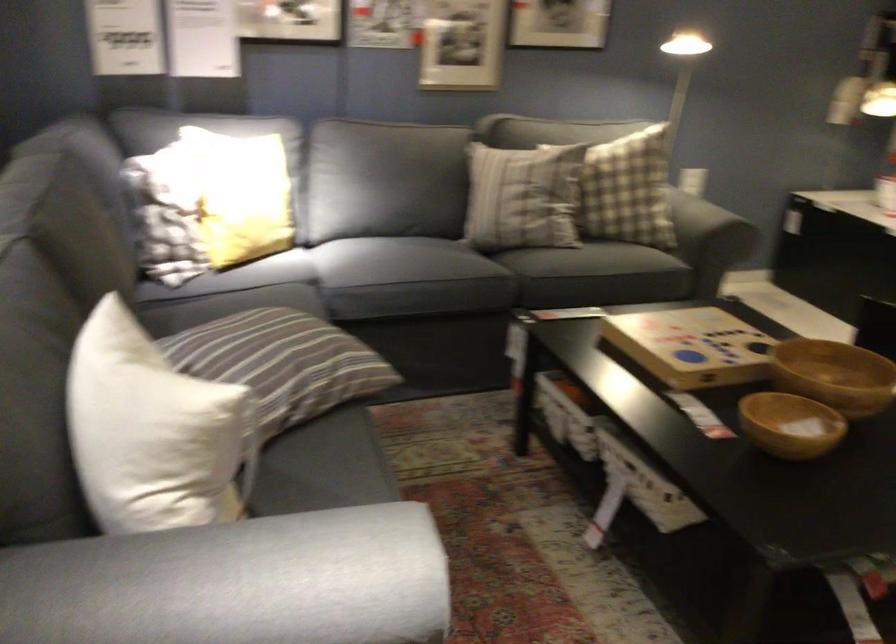
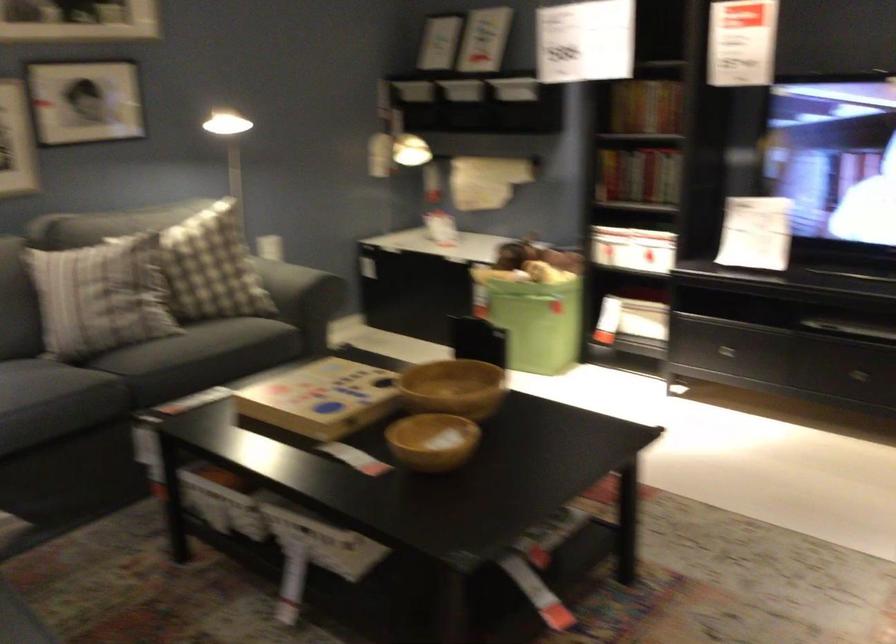
The point at (592, 274) is marked in the first image. Where is the corresponding point in the second image?

(199, 357)